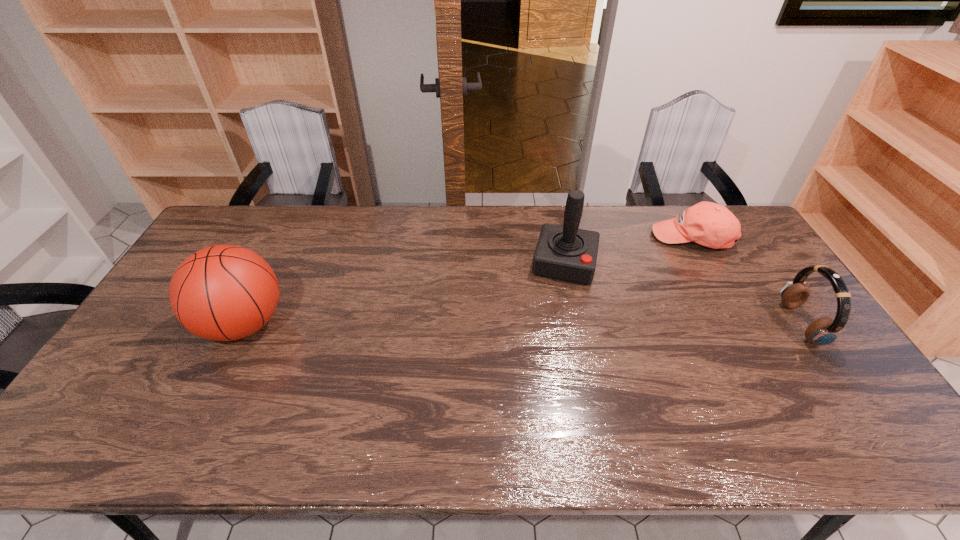
I want to click on the leftmost object, so click(223, 292).

Identify the location of the second shortest object. (823, 331).

The width and height of the screenshot is (960, 540). Identify the location of headset. (823, 331).

You are a GUI agent. You are given a task and a screenshot of the screen. Output one action in this format:
    pyautogui.click(x=<x>, y=<y>)
    Task: Click on the joystick
    The height and width of the screenshot is (540, 960).
    Given the screenshot: What is the action you would take?
    pyautogui.click(x=567, y=253)

At what (x,y) coordinates should I click in order to perform the action: click on baseball cap. Please return your answer as a coordinate pair (x, y). Looking at the image, I should click on (709, 224).

Identify the location of the shortest object. The image size is (960, 540). (709, 224).

Where is `vacant space located 0.120m on the back of the basketball`? The image size is (960, 540). vacant space located 0.120m on the back of the basketball is located at coordinates (274, 266).

You are a GUI agent. You are given a task and a screenshot of the screen. Output one action in this format:
    pyautogui.click(x=<x>, y=<y>)
    Task: Click on the vacant space positioned on the ear cup of the headset
    The image size is (960, 540).
    Given the screenshot: What is the action you would take?
    point(736,324)

I want to click on vacant space located on the ear cup of the headset, so click(715, 324).

The image size is (960, 540). I want to click on vacant area located on the ear cup of the headset, so click(x=771, y=324).